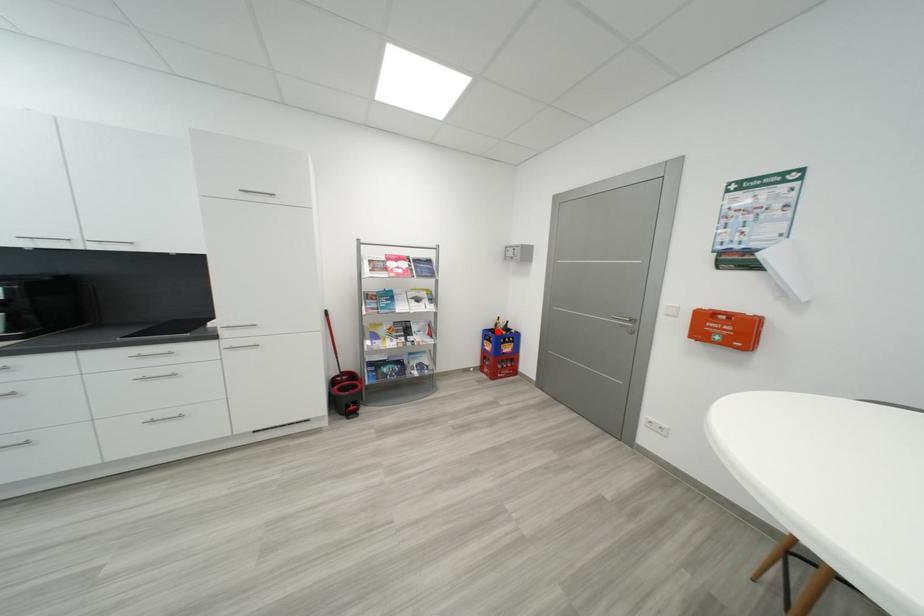
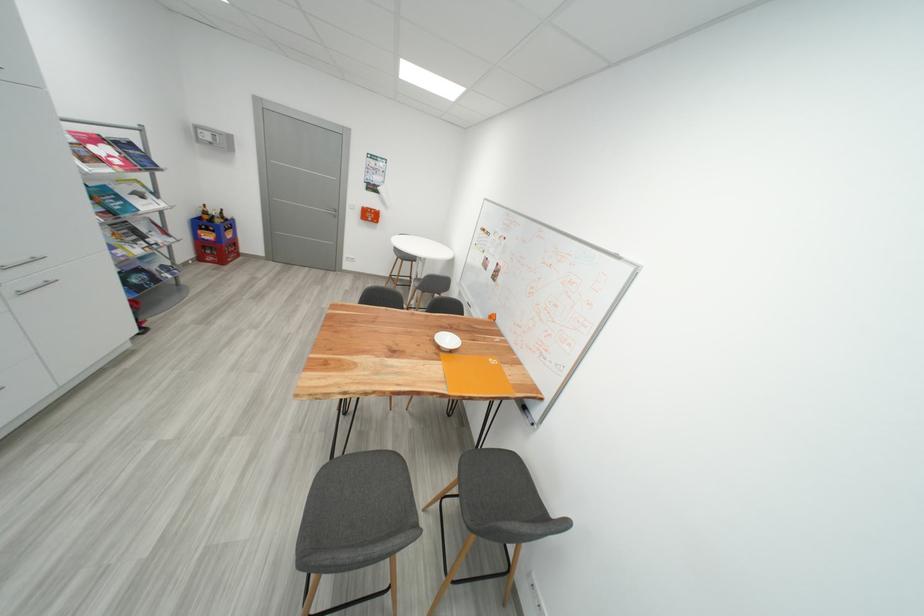
Question: I am providing you with two images of the same scene from different viewpoints. In image1, a red point is highlighted. Considering the same 3D point in image2, which of the following is correct?

Choices:
 (A) It is closer
 (B) It is farther

Answer: (A)